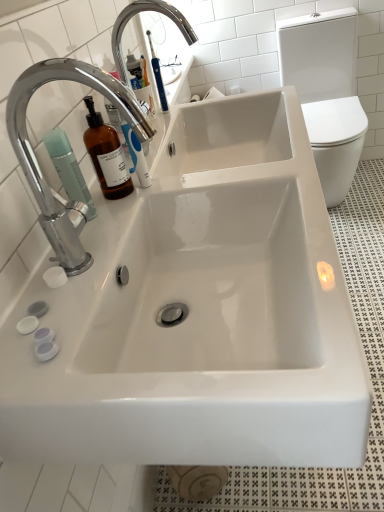
In order to face white glossy toilet bowl at right, should I rotate leftwards or rightwards?

You should rotate right by 17.306 degrees.

This screenshot has height=512, width=384. What are the coordinates of `matte green pump bottle at left` in the screenshot? It's located at (68, 169).

What are the coordinates of `chrome/metallic faucet at upper left, marked as the 1th tap in a front-to-back arrangement` in the screenshot? It's located at (38, 163).

What do you see at coordinates (38, 163) in the screenshot? The width and height of the screenshot is (384, 512). I see `chrome/metallic faucet at upper left, acting as the second tap starting from the top` at bounding box center [38, 163].

Where is `white glossy toilet bowl at right`? white glossy toilet bowl at right is located at coordinates (326, 92).

Is chrome metallic faucet at upper left, which is the second tap from bottom to top, further to camera compared to white glossy toilet bowl at right?

No, chrome metallic faucet at upper left, which is the second tap from bottom to top, is in front of white glossy toilet bowl at right.

Who is shorter, chrome metallic faucet at upper left, which appears as the first tap when viewed from the back, or white glossy toilet bowl at right?

Standing shorter between the two is chrome metallic faucet at upper left, which appears as the first tap when viewed from the back.

From a real-world perspective, which is physically below, chrome metallic faucet at upper left, which is the second tap from bottom to top, or white glossy toilet bowl at right?

white glossy toilet bowl at right.

Between chrome metallic faucet at upper left, which is the second tap from bottom to top, and white glossy toilet bowl at right, which one appears on the left side from the viewer's perspective?

Positioned to the left is chrome metallic faucet at upper left, which is the second tap from bottom to top.

From the image's perspective, between chrome/metallic faucet at upper left, marked as the 1th tap in a front-to-back arrangement, and chrome metallic faucet at upper left, the 1th tap when ordered from top to bottom, who is located below?

chrome/metallic faucet at upper left, marked as the 1th tap in a front-to-back arrangement.

Between point (45, 201) and point (114, 56), which one is positioned in front?

Point (45, 201)

Between chrome/metallic faucet at upper left, acting as the second tap starting from the top, and chrome metallic faucet at upper left, which is the second tap from bottom to top, which one is positioned in front?

chrome/metallic faucet at upper left, acting as the second tap starting from the top.

Between chrome/metallic faucet at upper left, acting as the second tap starting from the top, and chrome metallic faucet at upper left, the 1th tap when ordered from top to bottom, which one has larger width?

chrome metallic faucet at upper left, the 1th tap when ordered from top to bottom, is wider.

Can you confirm if chrome metallic faucet at upper left, which ranks as the 2th tap in front-to-back order, is bigger than matte green pump bottle at left?

Correct, chrome metallic faucet at upper left, which ranks as the 2th tap in front-to-back order, is larger in size than matte green pump bottle at left.

Considering the relative positions of chrome metallic faucet at upper left, the 1th tap when ordered from top to bottom, and matte green pump bottle at left in the image provided, is chrome metallic faucet at upper left, the 1th tap when ordered from top to bottom, to the left of matte green pump bottle at left from the viewer's perspective?

In fact, chrome metallic faucet at upper left, the 1th tap when ordered from top to bottom, is to the right of matte green pump bottle at left.

Who is more distant, chrome metallic faucet at upper left, which ranks as the 2th tap in front-to-back order, or matte green pump bottle at left?

chrome metallic faucet at upper left, which ranks as the 2th tap in front-to-back order, is further away from the camera.

Find the location of a particular element. Image resolution: width=384 pixels, height=512 pixels. cleaning product below the chrome metallic faucet at upper left, which appears as the first tap when viewed from the back (from a real-world perspective) is located at coordinates (68, 169).

Would you say matte green pump bottle at left is to the left or to the right of chrome metallic faucet at upper left, which is the second tap from bottom to top, in the picture?

matte green pump bottle at left is positioned on chrome metallic faucet at upper left, which is the second tap from bottom to top,'s left side.

Between matte green pump bottle at left and chrome metallic faucet at upper left, which is the second tap from bottom to top, which one is positioned in front?

matte green pump bottle at left is closer to the camera.

From a real-world perspective, which object stands above the other?

chrome metallic faucet at upper left, which ranks as the 2th tap in front-to-back order.

Is chrome metallic faucet at upper left, which is the second tap from bottom to top, located within matte green pump bottle at left?

No, chrome metallic faucet at upper left, which is the second tap from bottom to top, is not a part of matte green pump bottle at left.

Is chrome/metallic faucet at upper left, marked as the 1th tap in a front-to-back arrangement, smaller than matte green pump bottle at left?

Actually, chrome/metallic faucet at upper left, marked as the 1th tap in a front-to-back arrangement, might be larger than matte green pump bottle at left.

Is point (41, 78) closer to camera compared to point (73, 155)?

Yes, point (41, 78) is in front of point (73, 155).

Is chrome/metallic faucet at upper left, the first tap in the bottom-to-top sequence, taller than matte green pump bottle at left?

Indeed, chrome/metallic faucet at upper left, the first tap in the bottom-to-top sequence, has a greater height compared to matte green pump bottle at left.

Is chrome/metallic faucet at upper left, the second tap when ordered from back to front, looking in the opposite direction of matte green pump bottle at left?

chrome/metallic faucet at upper left, the second tap when ordered from back to front, is not turned away from matte green pump bottle at left.

Is white glossy toilet bowl at right bigger than matte green pump bottle at left?

Correct, white glossy toilet bowl at right is larger in size than matte green pump bottle at left.

Is matte green pump bottle at left a part of white glossy toilet bowl at right?

No, matte green pump bottle at left is located outside of white glossy toilet bowl at right.

Is white glossy toilet bowl at right positioned far away from matte green pump bottle at left?

Indeed, white glossy toilet bowl at right is not near matte green pump bottle at left.

Find the location of a particular element. This screenshot has height=512, width=384. tap located above the chrome/metallic faucet at upper left, acting as the second tap starting from the top (from the image's perspective) is located at coordinates (138, 13).

Considering the sizes of objects chrome metallic faucet at upper left, which is the second tap from bottom to top, and chrome/metallic faucet at upper left, acting as the second tap starting from the top, in the image provided, who is thinner, chrome metallic faucet at upper left, which is the second tap from bottom to top, or chrome/metallic faucet at upper left, acting as the second tap starting from the top,?

chrome/metallic faucet at upper left, acting as the second tap starting from the top.

What's the angular difference between chrome metallic faucet at upper left, the 1th tap when ordered from top to bottom, and chrome/metallic faucet at upper left, the second tap when ordered from back to front,'s facing directions?

The angle between the facing direction of chrome metallic faucet at upper left, the 1th tap when ordered from top to bottom, and the facing direction of chrome/metallic faucet at upper left, the second tap when ordered from back to front, is 0.00192 degrees.

From a real-world perspective, is chrome metallic faucet at upper left, which is the second tap from bottom to top, physically below chrome/metallic faucet at upper left, acting as the second tap starting from the top?

Yes, from a real-world perspective, chrome metallic faucet at upper left, which is the second tap from bottom to top, is under chrome/metallic faucet at upper left, acting as the second tap starting from the top.

From a real-world perspective, starting from the white glossy toilet bowl at right, which tap is the 1st one vertically above it? Please provide its 2D coordinates.

[(138, 13)]

This screenshot has width=384, height=512. I want to click on tap that is on the left side of chrome metallic faucet at upper left, which ranks as the 2th tap in front-to-back order, so click(38, 163).

Which object lies further to the anchor point white glossy toilet bowl at right, matte green pump bottle at left or chrome/metallic faucet at upper left, the first tap in the bottom-to-top sequence?

matte green pump bottle at left.

Based on their spatial positions, is chrome/metallic faucet at upper left, the first tap in the bottom-to-top sequence, or matte green pump bottle at left further from chrome metallic faucet at upper left, the 1th tap when ordered from top to bottom?

matte green pump bottle at left is positioned further to the anchor chrome metallic faucet at upper left, the 1th tap when ordered from top to bottom.

Looking at the image, which one is located further to chrome/metallic faucet at upper left, acting as the second tap starting from the top, white glossy toilet bowl at right or chrome metallic faucet at upper left, the 1th tap when ordered from top to bottom?

The object further to chrome/metallic faucet at upper left, acting as the second tap starting from the top, is white glossy toilet bowl at right.

Which object lies further to the anchor point chrome/metallic faucet at upper left, marked as the 1th tap in a front-to-back arrangement, matte green pump bottle at left or white glossy toilet bowl at right?

The object further to chrome/metallic faucet at upper left, marked as the 1th tap in a front-to-back arrangement, is white glossy toilet bowl at right.

Estimate the real-world distances between objects in this image. Which object is further from matte green pump bottle at left, chrome metallic faucet at upper left, which appears as the first tap when viewed from the back, or chrome/metallic faucet at upper left, the second tap when ordered from back to front?

chrome metallic faucet at upper left, which appears as the first tap when viewed from the back, lies further to matte green pump bottle at left than the other object.

From the picture: Based on their spatial positions, is white glossy toilet bowl at right or chrome/metallic faucet at upper left, the first tap in the bottom-to-top sequence, further from chrome metallic faucet at upper left, which is the second tap from bottom to top?

Among the two, white glossy toilet bowl at right is located further to chrome metallic faucet at upper left, which is the second tap from bottom to top.

Considering their positions, is white glossy toilet bowl at right positioned closer to matte green pump bottle at left than chrome metallic faucet at upper left, the 1th tap when ordered from top to bottom?

The object closer to matte green pump bottle at left is chrome metallic faucet at upper left, the 1th tap when ordered from top to bottom.

From the image, which object appears to be nearer to white glossy toilet bowl at right, chrome metallic faucet at upper left, which appears as the first tap when viewed from the back, or matte green pump bottle at left?

Among the two, chrome metallic faucet at upper left, which appears as the first tap when viewed from the back, is located nearer to white glossy toilet bowl at right.

Find the location of a particular element. cleaning product between chrome/metallic faucet at upper left, marked as the 1th tap in a front-to-back arrangement, and chrome metallic faucet at upper left, which appears as the first tap when viewed from the back, in the front-back direction is located at coordinates (68, 169).

Locate an element on the screen. cleaning product between chrome/metallic faucet at upper left, acting as the second tap starting from the top, and white glossy toilet bowl at right, along the z-axis is located at coordinates (68, 169).

In order to click on tap between chrome/metallic faucet at upper left, acting as the second tap starting from the top, and white glossy toilet bowl at right in the front-back direction in this screenshot , I will do pos(138,13).